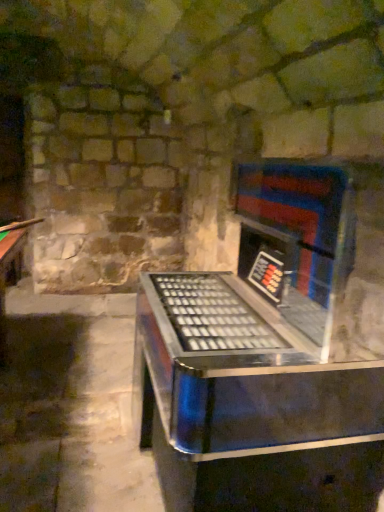
Question: Based on their positions, is brushed metal cue at left located to the left or right of metallic/reflective jukebox at center?

Choices:
 (A) left
 (B) right

Answer: (A)

Question: From their relative heights in the image, would you say brushed metal cue at left is taller or shorter than metallic/reflective jukebox at center?

Choices:
 (A) tall
 (B) short

Answer: (B)

Question: From the image's perspective, is brushed metal cue at left located above or below metallic/reflective jukebox at center?

Choices:
 (A) above
 (B) below

Answer: (A)

Question: Choose the correct answer: Is metallic/reflective jukebox at center inside brushed metal cue at left or outside it?

Choices:
 (A) inside
 (B) outside

Answer: (B)

Question: From a real-world perspective, is metallic/reflective jukebox at center positioned above or below brushed metal cue at left?

Choices:
 (A) below
 (B) above

Answer: (A)

Question: In terms of width, does metallic/reflective jukebox at center look wider or thinner when compared to brushed metal cue at left?

Choices:
 (A) wide
 (B) thin

Answer: (A)

Question: In the image, is metallic/reflective jukebox at center on the left side or the right side of brushed metal cue at left?

Choices:
 (A) right
 (B) left

Answer: (A)